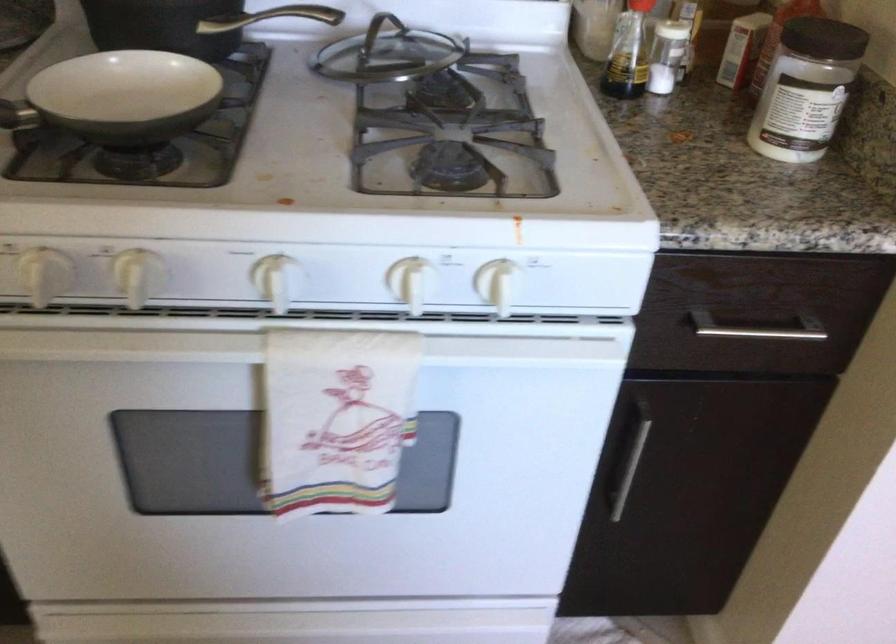
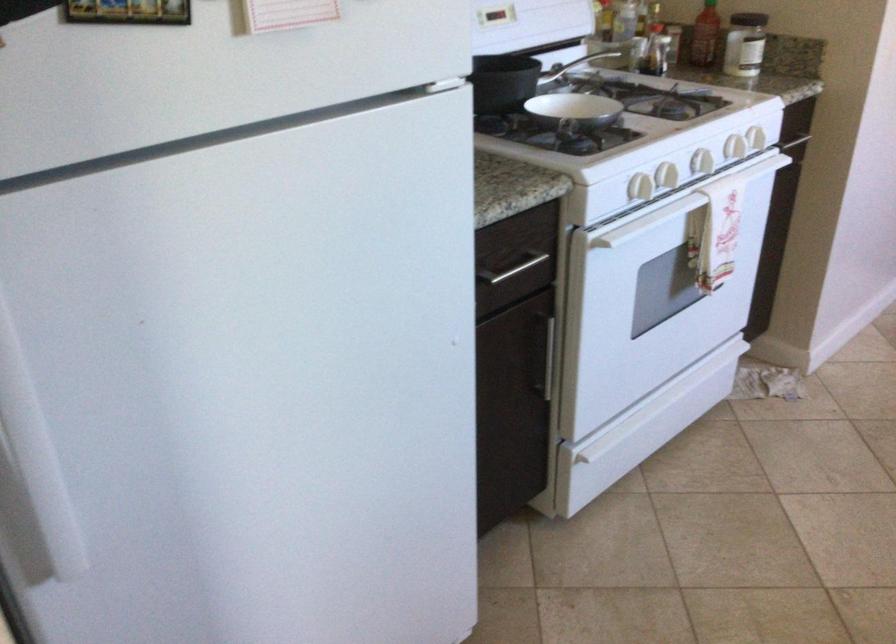
Locate, in the second image, the point that corresponds to pixel 460 95 in the first image.

(574, 64)